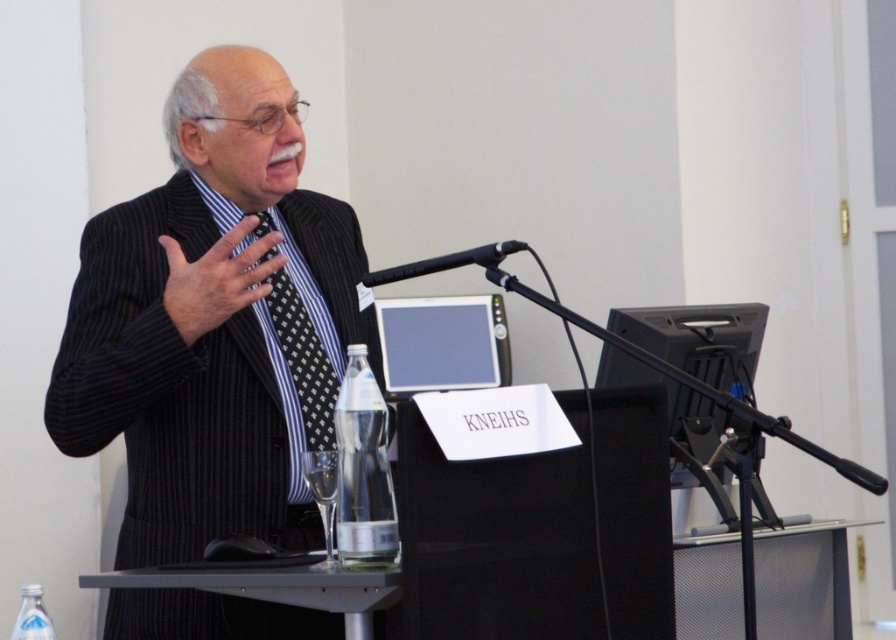
Question: Is black pinstripe suit at center above clear plastic bottle at lower left?

Choices:
 (A) no
 (B) yes

Answer: (B)

Question: Among these objects, which one is farthest from the camera?

Choices:
 (A) black matte microphone at center
 (B) black dotted tie at center

Answer: (B)

Question: Observing the image, what is the correct spatial positioning of black matte microphone at center in reference to clear plastic bottle at lower left?

Choices:
 (A) left
 (B) right

Answer: (B)

Question: Which point is farther to the camera?

Choices:
 (A) pos(42,632)
 (B) pos(237,608)
 (C) pos(451,257)

Answer: (B)

Question: Is black dotted tie at center below clear plastic bottle at lower left?

Choices:
 (A) no
 (B) yes

Answer: (A)

Question: Which object appears closest to the camera in this image?

Choices:
 (A) black dotted tie at center
 (B) black matte microphone at center
 (C) black pinstripe suit at center
 (D) clear plastic bottle at lower left

Answer: (B)